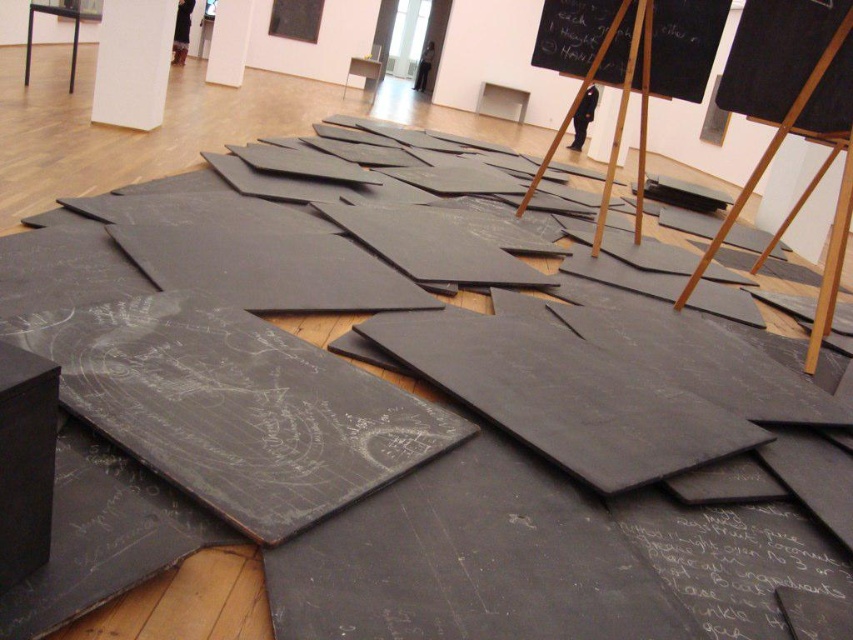
In the scene shown: Can you confirm if black chalkboard at center is positioned to the right of wooden easel at center?

In fact, black chalkboard at center is to the left of wooden easel at center.

Is black chalkboard at center to the left of wooden easel at center from the viewer's perspective?

Correct, you'll find black chalkboard at center to the left of wooden easel at center.

Between point (637, 506) and point (808, 353), which one is positioned in front?

Positioned in front is point (637, 506).

Locate an element on the screen. The height and width of the screenshot is (640, 853). black chalkboard at center is located at coordinates (734, 560).

Can you confirm if wooden easel at center is taller than smooth wood easel at center?

Incorrect, wooden easel at center's height is not larger of smooth wood easel at center's.

Identify the location of wooden easel at center. Image resolution: width=853 pixels, height=640 pixels. (793, 112).

Does black chalkboard at center have a greater width compared to black chalkboard at upper center?

Incorrect, black chalkboard at center's width does not surpass black chalkboard at upper center's.

Who is lower down, black chalkboard at center or black chalkboard at upper center?

Positioned lower is black chalkboard at center.

What do you see at coordinates (734, 560) in the screenshot? Image resolution: width=853 pixels, height=640 pixels. I see `black chalkboard at center` at bounding box center [734, 560].

Identify the location of black chalkboard at center. This screenshot has width=853, height=640. (734, 560).